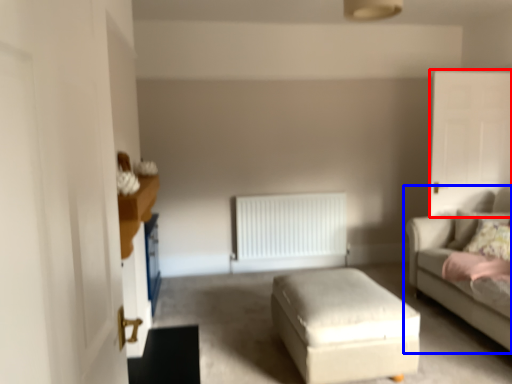
Question: Which of the following is the farthest to the observer, glass door (highlighted by a red box) or studio couch (highlighted by a blue box)?

Choices:
 (A) glass door
 (B) studio couch

Answer: (A)